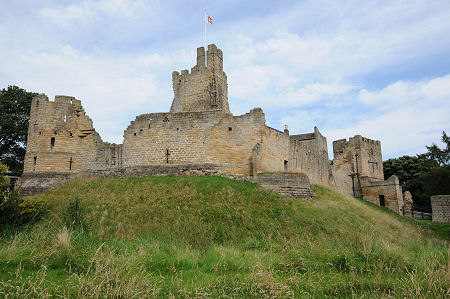
The height and width of the screenshot is (299, 450). What are the coordinates of `wall` in the screenshot? It's located at (137, 146), (75, 140), (293, 147).